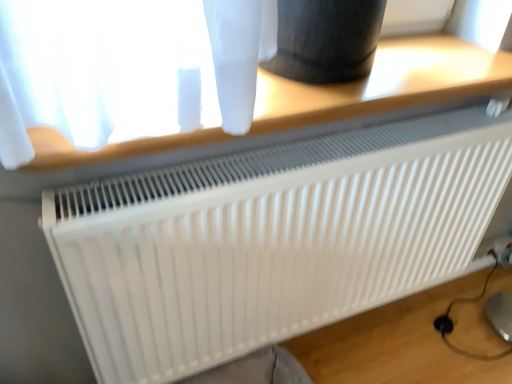
This screenshot has height=384, width=512. I want to click on free spot above white plastic table at upper center (from a real-world perspective), so click(391, 67).